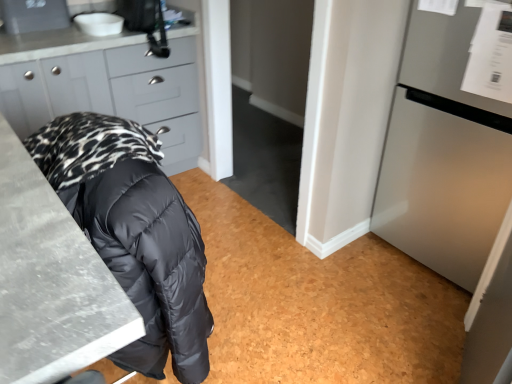
Question: Is white glossy sink at upper left not inside matte gray cabinets at upper left?

Choices:
 (A) no
 (B) yes

Answer: (B)

Question: From the image's perspective, is white glossy sink at upper left on matte gray cabinets at upper left?

Choices:
 (A) yes
 (B) no

Answer: (A)

Question: Considering the relative positions of white glossy sink at upper left and matte gray cabinets at upper left in the image provided, is white glossy sink at upper left to the left of matte gray cabinets at upper left from the viewer's perspective?

Choices:
 (A) no
 (B) yes

Answer: (A)

Question: Is white glossy sink at upper left taller than matte gray cabinets at upper left?

Choices:
 (A) yes
 (B) no

Answer: (B)

Question: From the image's perspective, is white glossy sink at upper left beneath matte gray cabinets at upper left?

Choices:
 (A) yes
 (B) no

Answer: (B)

Question: From a real-world perspective, is white glossy sink at upper left physically above matte gray cabinets at upper left?

Choices:
 (A) yes
 (B) no

Answer: (A)

Question: Considering the relative positions of matte gray cabinets at upper left and satin silver refrigerator at right in the image provided, is matte gray cabinets at upper left in front of satin silver refrigerator at right?

Choices:
 (A) yes
 (B) no

Answer: (B)

Question: Would you say matte gray cabinets at upper left is outside satin silver refrigerator at right?

Choices:
 (A) no
 (B) yes

Answer: (B)

Question: Considering the relative positions of matte gray cabinets at upper left and satin silver refrigerator at right in the image provided, is matte gray cabinets at upper left to the left of satin silver refrigerator at right from the viewer's perspective?

Choices:
 (A) yes
 (B) no

Answer: (A)

Question: From the image's perspective, is matte gray cabinets at upper left beneath satin silver refrigerator at right?

Choices:
 (A) no
 (B) yes

Answer: (A)

Question: From a real-world perspective, is matte gray cabinets at upper left physically below satin silver refrigerator at right?

Choices:
 (A) yes
 (B) no

Answer: (A)

Question: Is matte gray cabinets at upper left thinner than satin silver refrigerator at right?

Choices:
 (A) no
 (B) yes

Answer: (A)

Question: Is marble gray countertop at lower left at the back of matte gray cabinets at upper left?

Choices:
 (A) yes
 (B) no

Answer: (B)